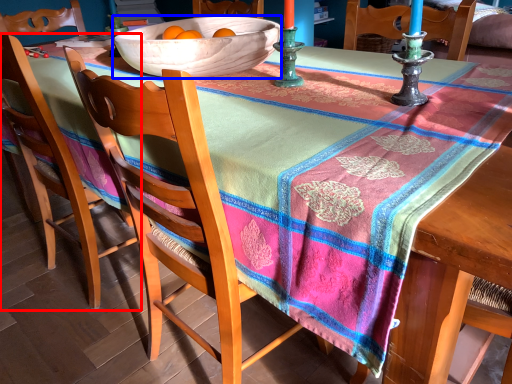
Question: Which point is further to the camera, chair (highlighted by a red box) or bowl (highlighted by a blue box)?

Choices:
 (A) chair
 (B) bowl

Answer: (A)